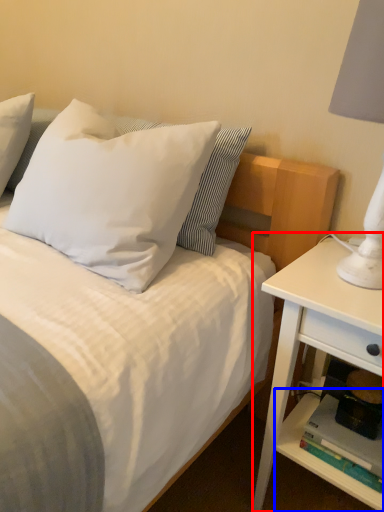
Question: Which object is further to the camera taking this photo, nightstand (highlighted by a red box) or shelf (highlighted by a blue box)?

Choices:
 (A) nightstand
 (B) shelf

Answer: (B)